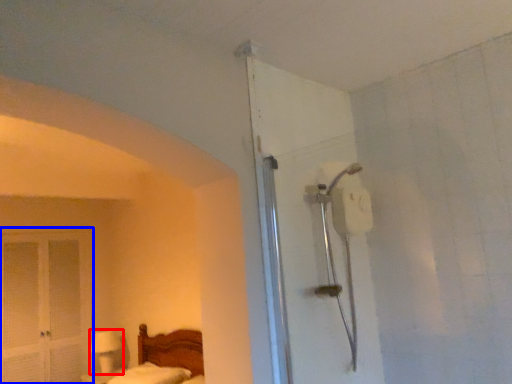
Question: Which point is closer to the camera, table lamp (highlighted by a red box) or screen door (highlighted by a blue box)?

Choices:
 (A) table lamp
 (B) screen door

Answer: (B)